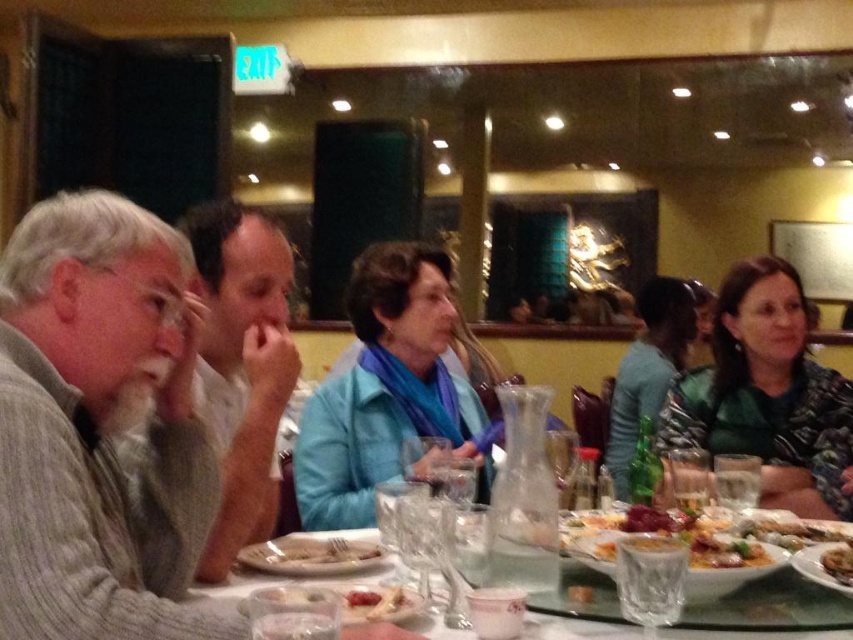
Is clear glass tableware at center smaller than translucent plastic bag at center?

No, clear glass tableware at center is not smaller than translucent plastic bag at center.

Is point (567, 596) positioned in front of point (310, 586)?

No.

Does point (566, 564) lie behind point (347, 618)?

Yes, point (566, 564) is farther from viewer.

Locate an element on the screen. The image size is (853, 640). clear glass tableware at center is located at coordinates (770, 608).

Who is taller, clear glass tableware at center or golden crispy pastry at center?

clear glass tableware at center is taller.

Can you confirm if clear glass tableware at center is positioned to the left of golden crispy pastry at center?

Indeed, clear glass tableware at center is positioned on the left side of golden crispy pastry at center.

Consider the image. Who is more forward, (820,611) or (840,550)?

Point (820,611) is in front.

Image resolution: width=853 pixels, height=640 pixels. Find the location of `clear glass tableware at center`. clear glass tableware at center is located at coordinates (770, 608).

Is gray knitted sweater at left in front of clear glass tableware at center?

Yes, it is in front of clear glass tableware at center.

Does gray knitted sweater at left have a larger size compared to clear glass tableware at center?

Yes.

At what (x,y) coordinates should I click in order to perform the action: click on gray knitted sweater at left. Please return your answer as a coordinate pair (x, y). This screenshot has height=640, width=853. Looking at the image, I should click on (100, 428).

Locate an element on the screen. The width and height of the screenshot is (853, 640). gray knitted sweater at left is located at coordinates (100, 428).